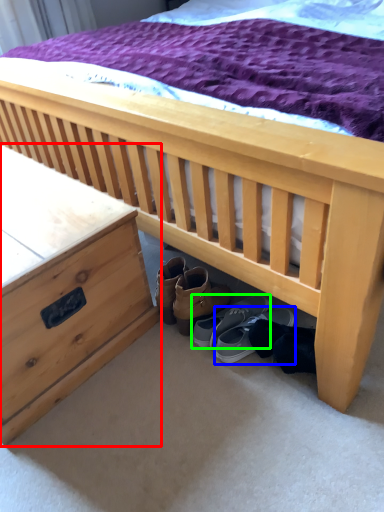
Question: Estimate the real-world distances between objects in this image. Which object is farther from nightstand (highlighted by a red box), footwear (highlighted by a blue box) or footwear (highlighted by a green box)?

Choices:
 (A) footwear
 (B) footwear

Answer: (A)